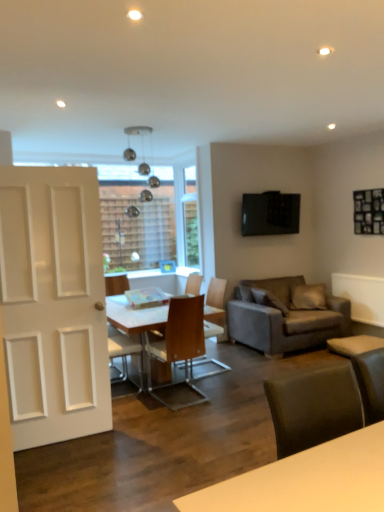
Question: Is wooden chair at center, which ranks as the fourth chair in front-to-back order, wider or thinner than wooden chair at center, positioned as the 2th chair in back-to-front order?

Choices:
 (A) wide
 (B) thin

Answer: (B)

Question: Considering the positions of wooden chair at center, which appears as the first chair when viewed from the back, and wooden chair at center, positioned as the 2th chair in back-to-front order, in the image, is wooden chair at center, which appears as the first chair when viewed from the back, taller or shorter than wooden chair at center, positioned as the 2th chair in back-to-front order,?

Choices:
 (A) tall
 (B) short

Answer: (B)

Question: Which object is positioned closest to the wooden chair at center, which ranks as the fourth chair in front-to-back order?

Choices:
 (A) wooden chair at center, arranged as the first chair when viewed from the front
 (B) dark gray fabric couch at center right
 (C) light brown wooden chair at center, which ranks as the third chair in back-to-front order
 (D) white matte door at left
 (E) wooden chair at center, marked as the 3th chair in a front-to-back arrangement

Answer: (E)

Question: Which object is the farthest from the wooden chair at center, marked as the 3th chair in a front-to-back arrangement?

Choices:
 (A) wooden chair at center, which ranks as the fourth chair in front-to-back order
 (B) light brown wooden chair at center, placed as the second chair when sorted from front to back
 (C) white glossy table at center
 (D) wooden chair at center, arranged as the first chair when viewed from the front
 (E) dark gray fabric couch at center right

Answer: (B)